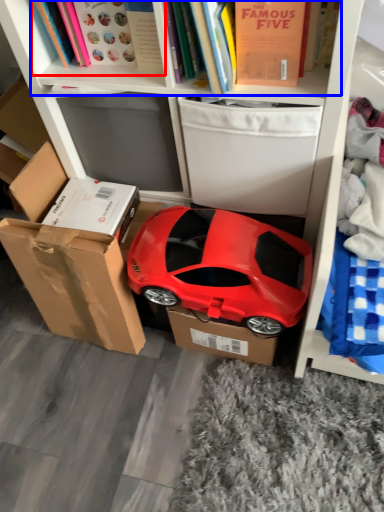
Question: Which of the following is the farthest to the observer, book (highlighted by a red box) or book (highlighted by a blue box)?

Choices:
 (A) book
 (B) book

Answer: (A)